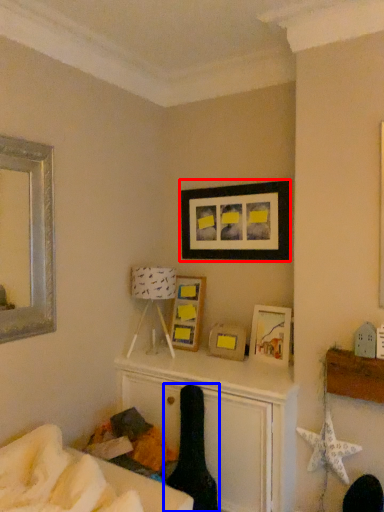
Question: Among these objects, which one is farthest to the camera, picture frame (highlighted by a red box) or swivel chair (highlighted by a blue box)?

Choices:
 (A) picture frame
 (B) swivel chair

Answer: (A)